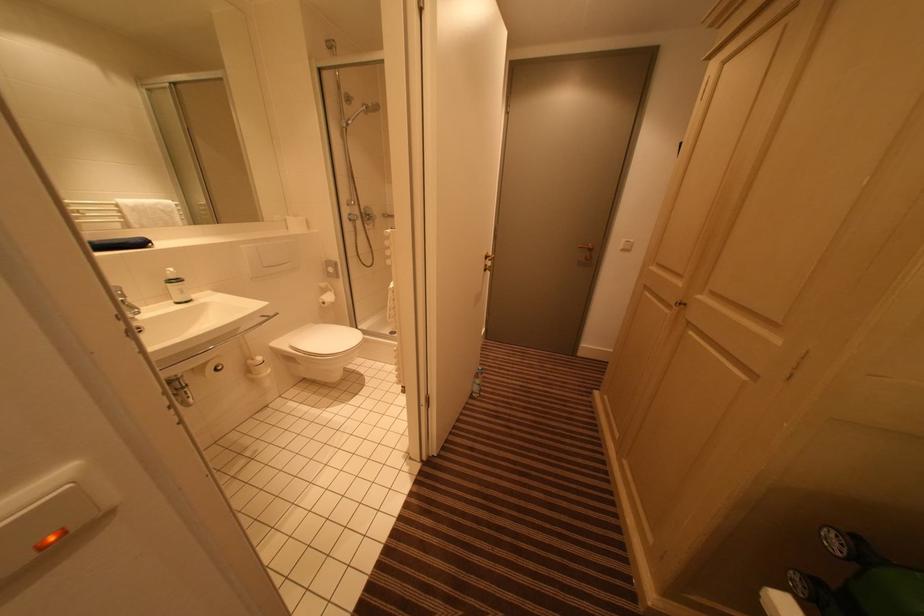
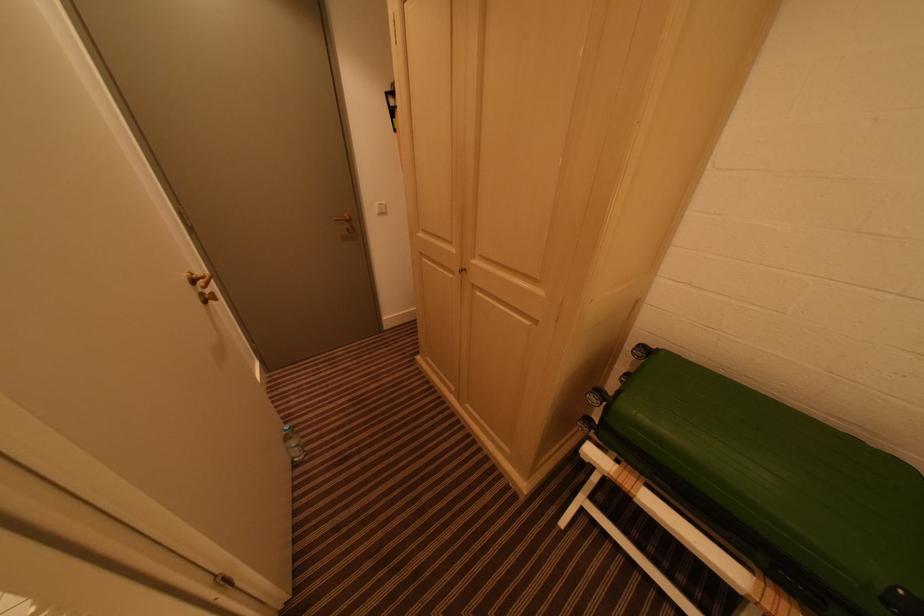
Locate, in the second image, the point that corresponds to point (492, 259) in the first image.

(200, 284)